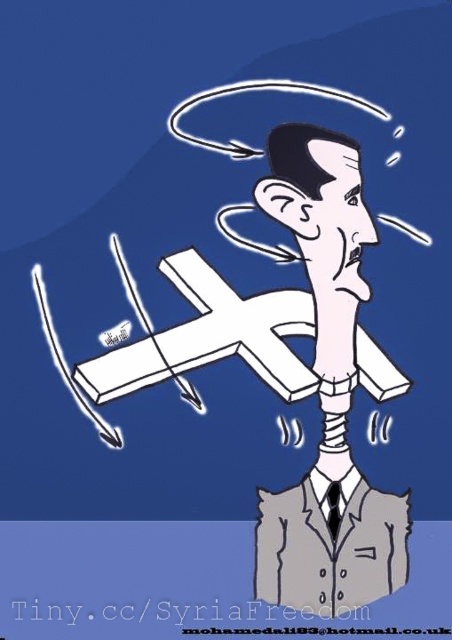
You are an assistant analyzing the image. The gray suit at center has a specific coordinate point marked as point (326, 394). What does this point indicate about the position of the gray suit at center?

The point (326, 394) marks the gray suit at center, indicating its central position in the image.

You are an assistant helping to organize a costume party. You see two suits in the image, the gray suit at center and the gray fabric business suit at center. Which one is positioned to the left?

The gray suit at center is positioned to the left of the gray fabric business suit at center.

In the scene shown: You are an artist analyzing this image. You notice the white matte cross at center and the gray fabric business suit at center. Which object is positioned higher in the image?

The white matte cross at center is above the gray fabric business suit at center, so it is positioned higher in the image.